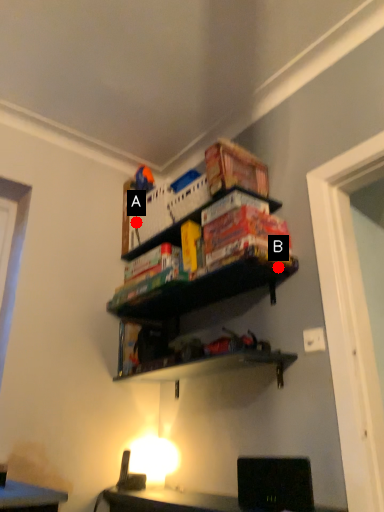
Question: Two points are circled on the image, labeled by A and B beside each circle. Which point is closer to the camera?

Choices:
 (A) A is closer
 (B) B is closer

Answer: (B)